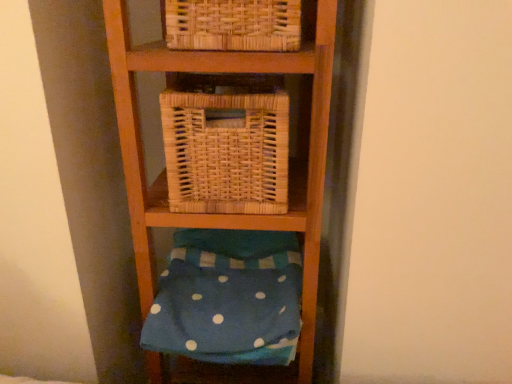
Question: From a real-world perspective, relative to blue polka dot fabric at lower center, is woven natural basket at center vertically above or below?

Choices:
 (A) below
 (B) above

Answer: (B)

Question: Is point (181, 185) closer or farther from the camera than point (159, 334)?

Choices:
 (A) farther
 (B) closer

Answer: (B)

Question: From the image's perspective, is woven natural basket at center located above or below blue polka dot fabric at lower center?

Choices:
 (A) above
 (B) below

Answer: (A)

Question: From the image's perspective, is blue polka dot fabric at lower center above or below woven natural basket at center?

Choices:
 (A) below
 (B) above

Answer: (A)

Question: Is blue polka dot fabric at lower center bigger or smaller than woven natural basket at center?

Choices:
 (A) small
 (B) big

Answer: (B)

Question: Is point (281, 317) closer or farther from the camera than point (236, 145)?

Choices:
 (A) closer
 (B) farther

Answer: (B)

Question: Based on their positions, is blue polka dot fabric at lower center located to the left or right of woven natural basket at center?

Choices:
 (A) right
 (B) left

Answer: (B)